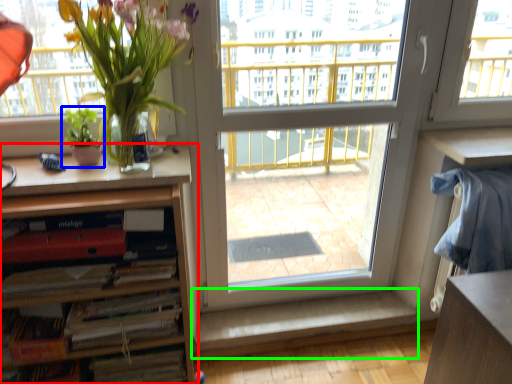
Question: Which object is positioned closest to cabinetry (highlighted by a red box)? Select from houseplant (highlighted by a blue box) and window sill (highlighted by a green box).

Choices:
 (A) houseplant
 (B) window sill

Answer: (A)